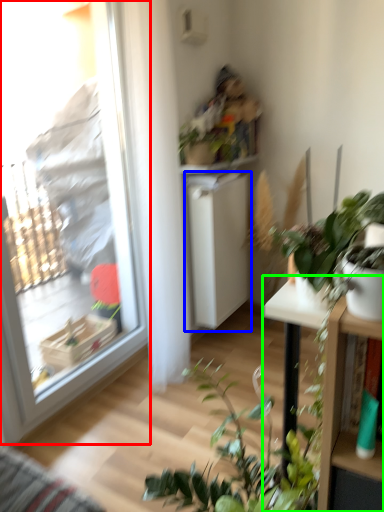
Question: Estimate the real-world distances between objects in this image. Which object is farther from window (highlighted by a red box), shelf (highlighted by a blue box) or table (highlighted by a green box)?

Choices:
 (A) shelf
 (B) table

Answer: (B)